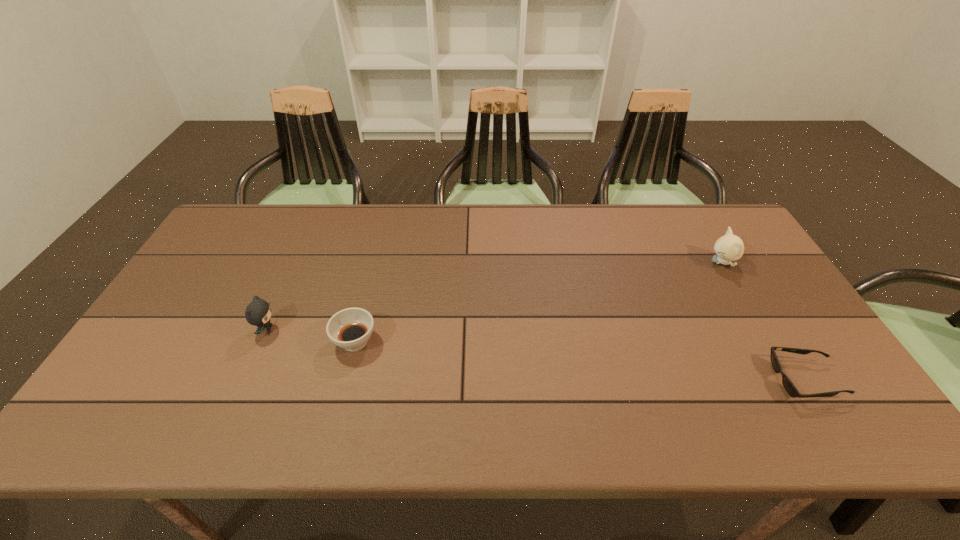
At what (x,y) coordinates should I click in order to perform the action: click on the farthest object. Please return your answer as a coordinate pair (x, y). Looking at the image, I should click on (729, 247).

Locate an element on the screen. The width and height of the screenshot is (960, 540). the farther kitten is located at coordinates (729, 247).

This screenshot has height=540, width=960. In order to click on the leftmost object in this screenshot , I will do `click(258, 312)`.

At what (x,y) coordinates should I click in order to perform the action: click on the nearer kitten. Please return your answer as a coordinate pair (x, y). The image size is (960, 540). Looking at the image, I should click on (258, 312).

What are the coordinates of `the third object from right to left` in the screenshot? It's located at (350, 328).

This screenshot has height=540, width=960. In order to click on the second shortest object in this screenshot , I will do `click(350, 328)`.

The height and width of the screenshot is (540, 960). I want to click on the shortest object, so click(x=787, y=383).

Image resolution: width=960 pixels, height=540 pixels. Find the location of `free space located on the face of the right kitten`. free space located on the face of the right kitten is located at coordinates (596, 262).

Locate an element on the screen. The image size is (960, 540). vacant position located on the face of the right kitten is located at coordinates (664, 262).

The width and height of the screenshot is (960, 540). In order to click on vacant region located 0.110m on the face of the right kitten in this screenshot , I will do `click(674, 262)`.